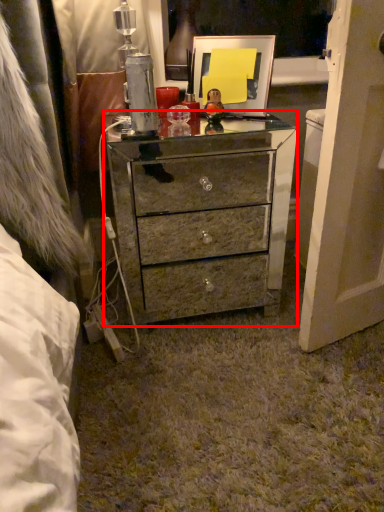
Question: From the image's perspective, what is the correct spatial relationship of chest of drawers (annotated by the red box) in relation to picture frame?

Choices:
 (A) below
 (B) above

Answer: (A)